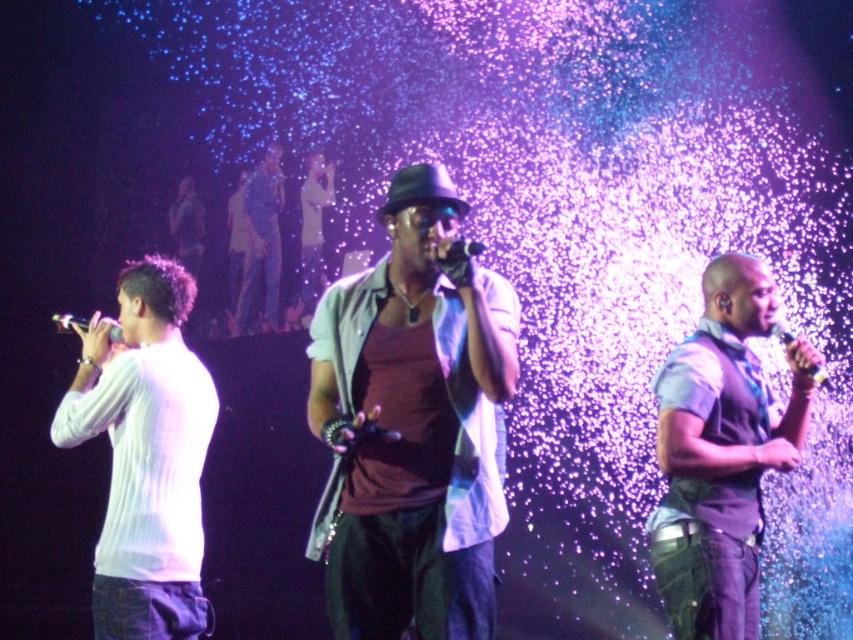
Question: Does purple matte vest at center appear over matte black microphone at left?

Choices:
 (A) yes
 (B) no

Answer: (B)

Question: Which point is closer to the camera?

Choices:
 (A) metallic silver microphone at right
 (B) white ribbed sweater at left
 (C) matte black microphone at left

Answer: (B)

Question: Does black matte microphone at center come behind metallic silver microphone at right?

Choices:
 (A) no
 (B) yes

Answer: (A)

Question: Which point is farther to the camera?

Choices:
 (A) (416, 388)
 (B) (126, 417)
 (C) (55, 314)
 (D) (822, 380)

Answer: (C)

Question: Is matte black hat at center thinner than black matte microphone at center?

Choices:
 (A) yes
 (B) no

Answer: (B)

Question: Which point is farther to the camera?

Choices:
 (A) black matte microphone at center
 (B) matte black hat at center
 (C) purple matte vest at center
 (D) metallic silver microphone at right

Answer: (D)